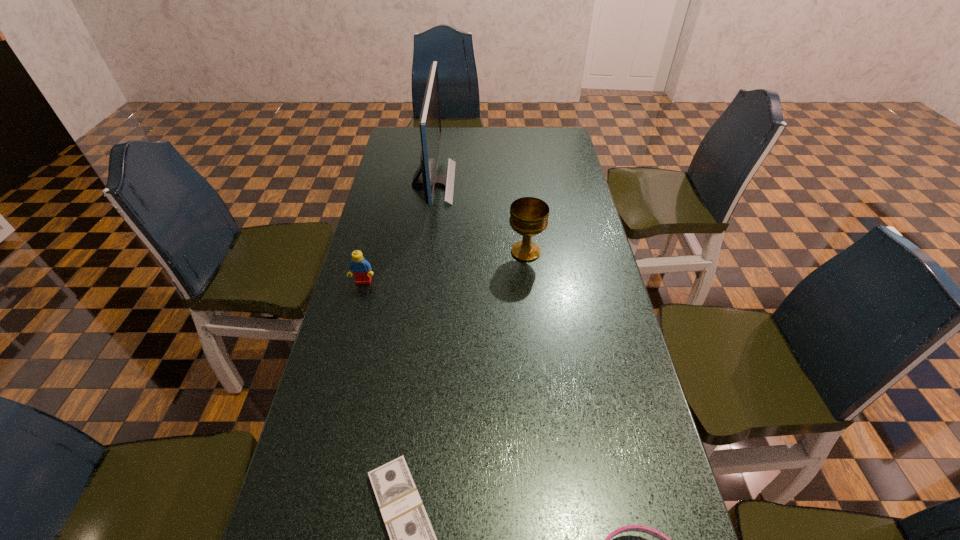
The image size is (960, 540). I want to click on the tallest object, so click(x=430, y=118).

Identify the location of the farthest object. (430, 118).

Find the location of a particular element. The image size is (960, 540). chalice is located at coordinates (529, 216).

In order to click on the second farthest object in this screenshot , I will do `click(529, 216)`.

Identify the location of Lego. (361, 268).

Identify the location of the third nearest object. The image size is (960, 540). (361, 268).

Locate an element on the screen. free spot located 0.240m on the screen side of the farthest object is located at coordinates (518, 183).

You are a GUI agent. You are given a task and a screenshot of the screen. Output one action in this format:
    pyautogui.click(x=<x>, y=<y>)
    Task: Click on the vacant space located on the front of the second tallest object
    The width and height of the screenshot is (960, 540).
    Given the screenshot: What is the action you would take?
    pyautogui.click(x=529, y=281)

The height and width of the screenshot is (540, 960). In order to click on vacant space located on the face of the leftmost object in this screenshot , I will do `click(330, 408)`.

What are the coordinates of `object at the far edge` in the screenshot? It's located at (430, 118).